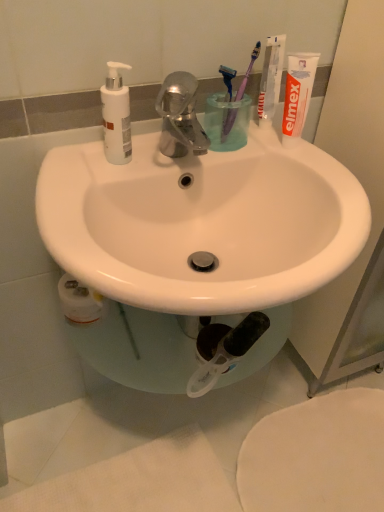
Image resolution: width=384 pixels, height=512 pixels. I want to click on free spot in front of white glossy toothpaste at upper right, the first toothpaste viewed from the left, so click(281, 156).